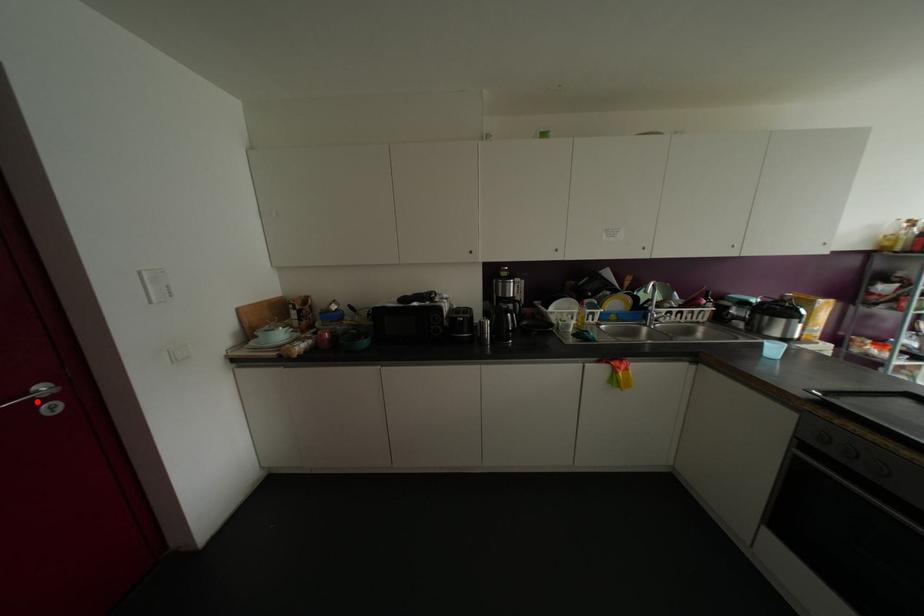
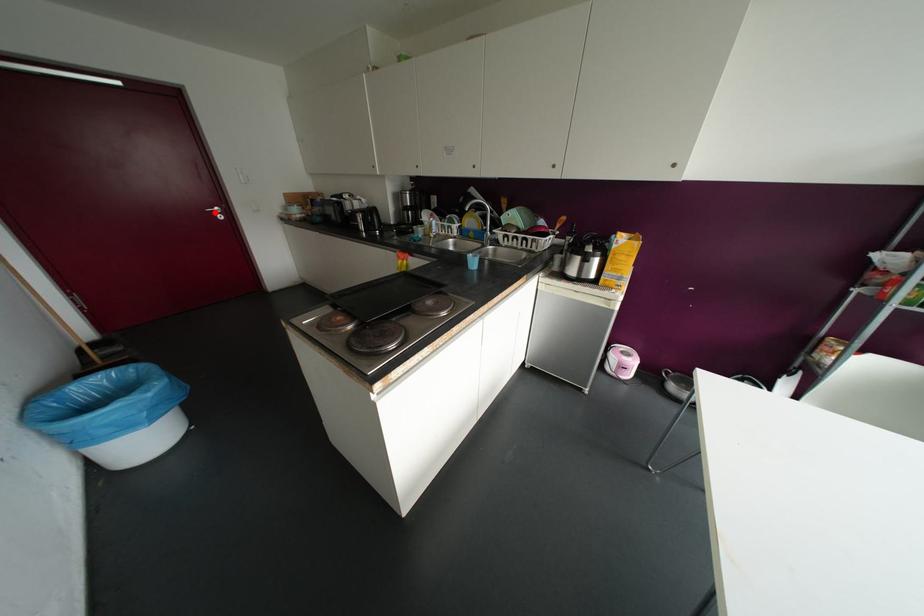
I am providing you with two images of the same scene from different viewpoints. A red point is marked on the first image and another point is marked on the second image. Do the highlighted points in image1 and image2 indicate the same real-world spot?

Yes